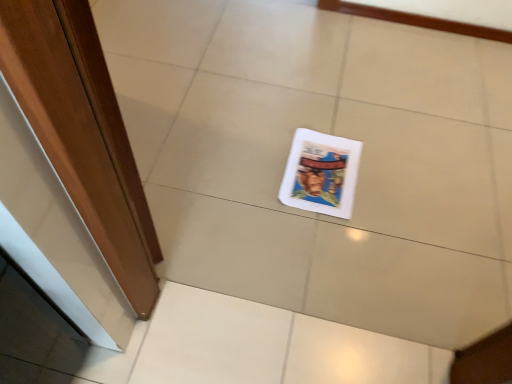
At what (x,y) coordinates should I click in order to perform the action: click on vacant point to the right of white glossy magazine at center. Please return your answer as a coordinate pair (x, y). The width and height of the screenshot is (512, 384). Looking at the image, I should click on click(x=400, y=180).